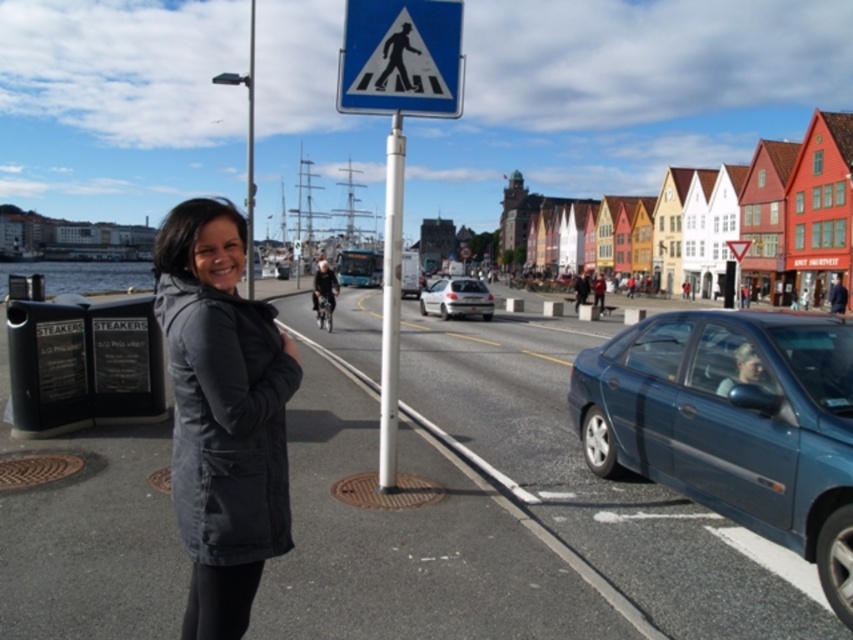
You are a pedestrian standing on the sidewalk and see both the dark gray fabric jacket at left and the dark gray jacket at center. Which one is closer to you?

The dark gray fabric jacket at left is closer to you because it is in front of the dark gray jacket at center.

You are a photographer trying to capture both the dark gray fabric jacket at left and the metallic pole at center in the same frame. Based on their sizes, which object would appear closer to the camera?

The dark gray fabric jacket at left appears closer to the camera because it has a smaller size compared to the metallic pole at center.

You are a delivery person who needs to place a package on a stand that is 30 feet away from the white smooth pole at center. Can you reach the stand from the dark gray fabric jacket at left without moving it?

The dark gray fabric jacket at left is 29.22 feet from the white smooth pole at center, so yes, the stand is within reach since it is only 0.78 feet beyond the jacket.